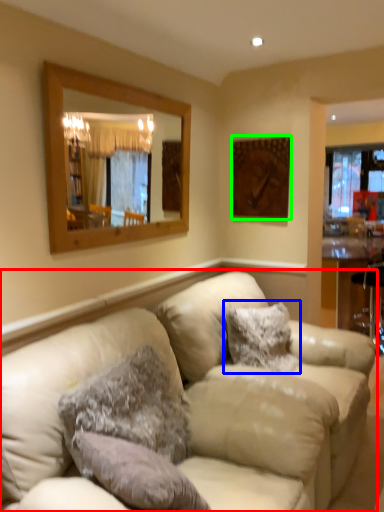
Question: Considering the real-world distances, which object is closest to studio couch (highlighted by a red box)? pillow (highlighted by a blue box) or picture frame (highlighted by a green box).

Choices:
 (A) pillow
 (B) picture frame

Answer: (A)